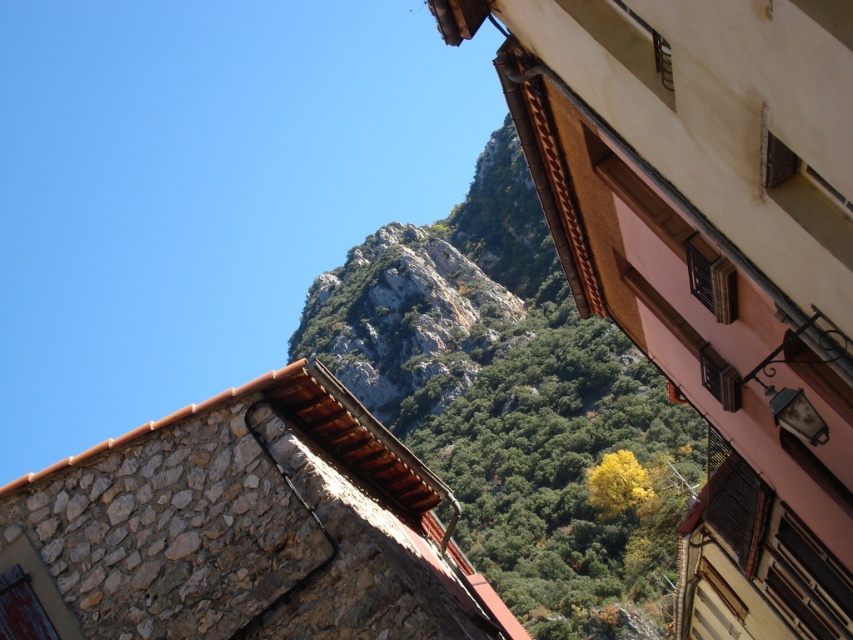
You are standing at the point marked as point (512, 401) in the image. What type of material or texture can you observe at that exact location?

At point (512, 401), the material or texture is rockymaterialtexturemountain.